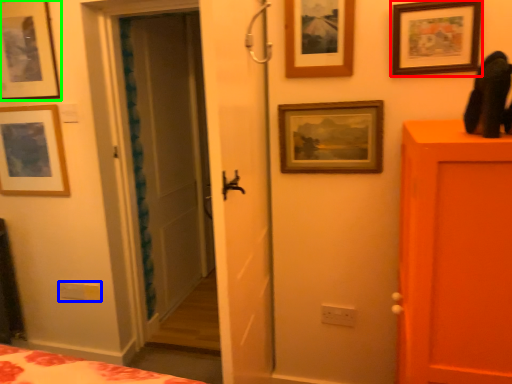
Question: Which is nearer to the picture frame (highlighted by a red box)? light switch (highlighted by a blue box) or picture frame (highlighted by a green box).

Choices:
 (A) light switch
 (B) picture frame

Answer: (B)